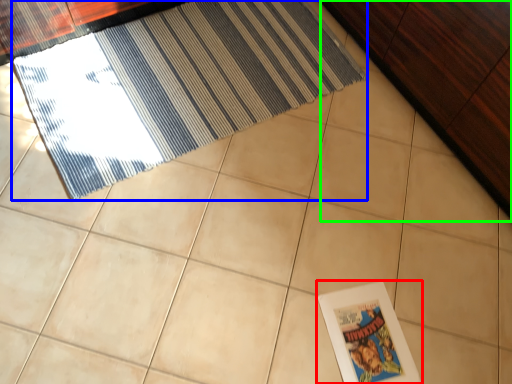
Question: Estimate the real-world distances between objects in this image. Which object is farther from picture frame (highlighted by a red box), door (highlighted by a blue box) or dresser (highlighted by a green box)?

Choices:
 (A) door
 (B) dresser

Answer: (A)